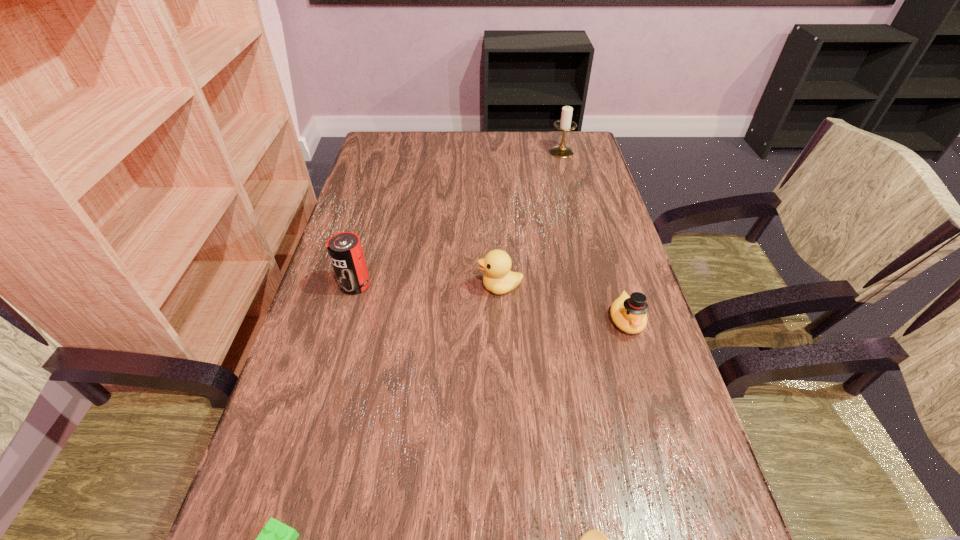
The image size is (960, 540). Find the location of `vacant region located 0.090m on the front-facing side of the fourth farthest object`. vacant region located 0.090m on the front-facing side of the fourth farthest object is located at coordinates (643, 377).

The width and height of the screenshot is (960, 540). In order to click on object that is at the far edge in this screenshot , I will do `click(565, 124)`.

Identify the location of object present at the left edge. This screenshot has height=540, width=960. (345, 250).

You are a GUI agent. You are given a task and a screenshot of the screen. Output one action in this format:
    pyautogui.click(x=<x>, y=<y>)
    Task: Click on the candle holder at the right edge
    
    Given the screenshot: What is the action you would take?
    pyautogui.click(x=565, y=124)

Locate an element on the screen. The width and height of the screenshot is (960, 540). duck positioned at the right edge is located at coordinates (628, 313).

This screenshot has width=960, height=540. Find the location of `object at the far right corner`. object at the far right corner is located at coordinates (565, 124).

Find the location of a particular element. The width and height of the screenshot is (960, 540). vacant space at the far edge of the desktop is located at coordinates (541, 156).

You are a GUI agent. You are given a task and a screenshot of the screen. Output one action in this format:
    pyautogui.click(x=<x>, y=<y>)
    Task: Click on the vacant space at the left edge of the desktop
    The image size is (960, 540).
    Given the screenshot: What is the action you would take?
    pyautogui.click(x=398, y=171)

The width and height of the screenshot is (960, 540). I want to click on free space at the right edge, so click(x=614, y=254).

Where is `vacant region at the far left corner of the desktop`? This screenshot has width=960, height=540. vacant region at the far left corner of the desktop is located at coordinates (407, 140).